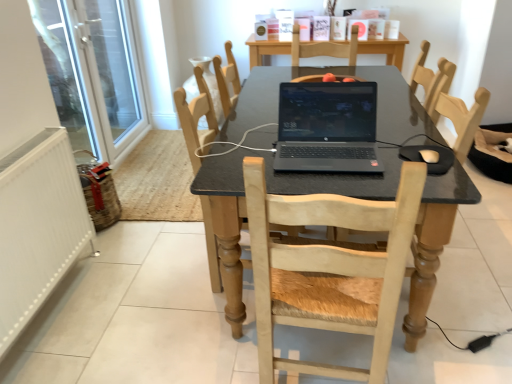
Where is `unoccupied space behind white textured radiator at left`? unoccupied space behind white textured radiator at left is located at coordinates (132, 249).